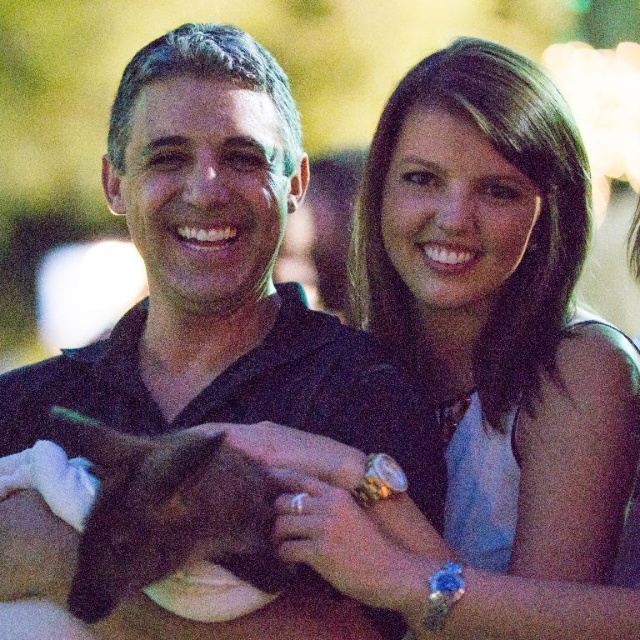
The height and width of the screenshot is (640, 640). What are the coordinates of `satin white dress at upper right` in the screenshot? It's located at (499, 308).

Is satin white dress at upper right below black fur cat at center?

Yes.

The height and width of the screenshot is (640, 640). What do you see at coordinates (499, 308) in the screenshot?
I see `satin white dress at upper right` at bounding box center [499, 308].

Find the location of a particular element. This screenshot has height=640, width=640. satin white dress at upper right is located at coordinates (499, 308).

Between black matte shirt at center and satin white dress at upper right, which one has less height?

Standing shorter between the two is satin white dress at upper right.

Between black matte shirt at center and satin white dress at upper right, which one is positioned higher?

black matte shirt at center is above.

Identify the location of black matte shirt at center. (218, 275).

Between black matte shirt at center and black fur cat at center, which one appears on the right side from the viewer's perspective?

black matte shirt at center is more to the right.

Can you confirm if black matte shirt at center is positioned below black fur cat at center?

Actually, black matte shirt at center is above black fur cat at center.

You are a GUI agent. You are given a task and a screenshot of the screen. Output one action in this format:
    pyautogui.click(x=<x>, y=<y>)
    Task: Click on the black matte shirt at center
    The height and width of the screenshot is (640, 640).
    Given the screenshot: What is the action you would take?
    pyautogui.click(x=218, y=275)

This screenshot has height=640, width=640. I want to click on black matte shirt at center, so click(218, 275).